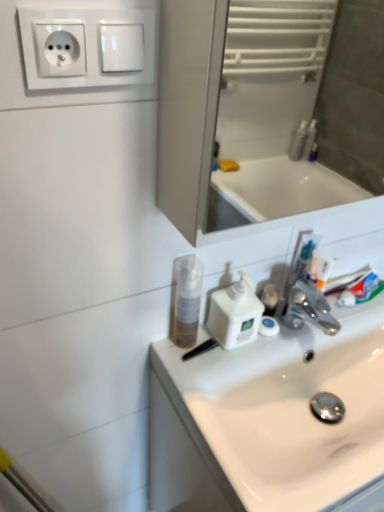
Question: Do you think translucent plastic mouthwash at sink is within white glossy sink at center, or outside of it?

Choices:
 (A) outside
 (B) inside

Answer: (A)

Question: Looking at their shapes, would you say translucent plastic mouthwash at sink is wider or thinner than white glossy sink at center?

Choices:
 (A) thin
 (B) wide

Answer: (A)

Question: Estimate the real-world distances between objects in this image. Which object is closer to the translucent plastic mouthwash at sink?

Choices:
 (A) white plastic socket at upper left
 (B) white plastic soap dispenser at center
 (C) white glossy sink at center

Answer: (B)

Question: Considering the real-world distances, which object is farthest from the translucent plastic mouthwash at sink?

Choices:
 (A) white glossy sink at center
 (B) white plastic soap dispenser at center
 (C) white plastic socket at upper left

Answer: (C)